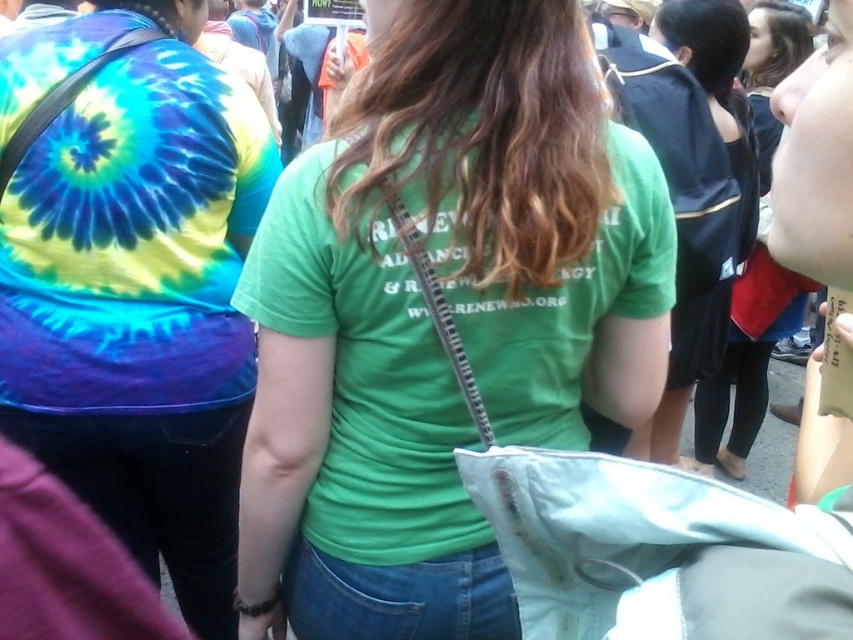
Question: From the image, what is the correct spatial relationship of green matte t-shirt at center in relation to tie-dye fabric shirt at left?

Choices:
 (A) right
 (B) left

Answer: (A)

Question: Considering the relative positions of green matte t-shirt at center and tie-dye fabric shirt at left in the image provided, where is green matte t-shirt at center located with respect to tie-dye fabric shirt at left?

Choices:
 (A) left
 (B) right

Answer: (B)

Question: Is green matte t-shirt at center positioned behind tie-dye fabric shirt at left?

Choices:
 (A) yes
 (B) no

Answer: (B)

Question: Among these points, which one is nearest to the camera?

Choices:
 (A) (144, 115)
 (B) (395, 58)

Answer: (B)

Question: Which object is farther from the camera taking this photo?

Choices:
 (A) tie-dye fabric shirt at left
 (B) green matte t-shirt at center

Answer: (A)

Question: Which object is farther from the camera taking this photo?

Choices:
 (A) tie-dye fabric shirt at left
 (B) green matte t-shirt at center

Answer: (A)